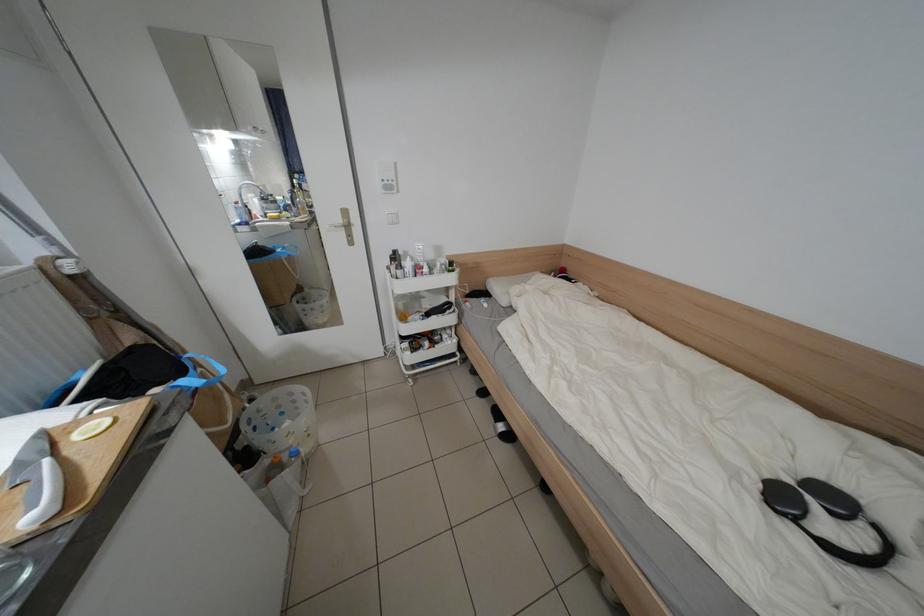
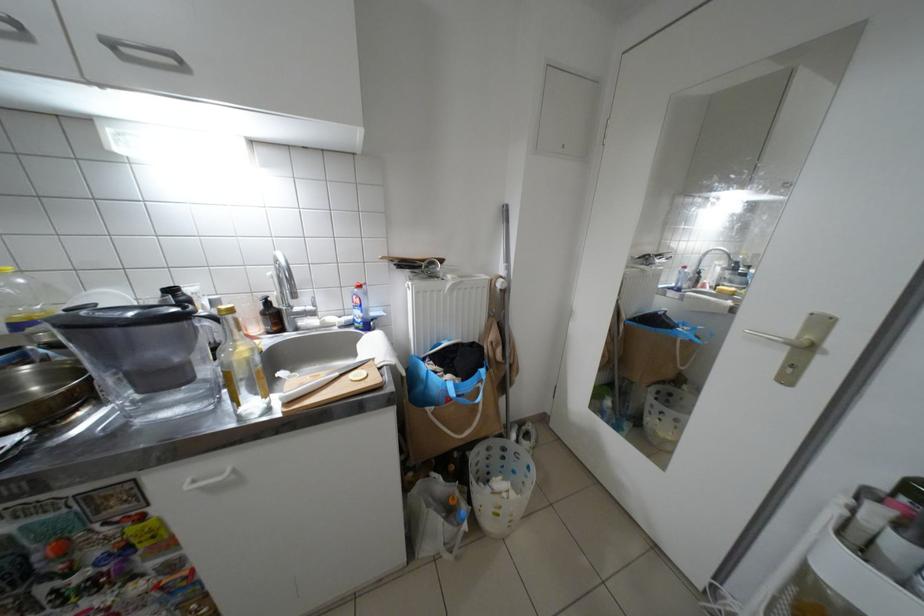
Locate, in the second image, the point that corresponds to the point at 249,204 in the first image.

(697, 269)